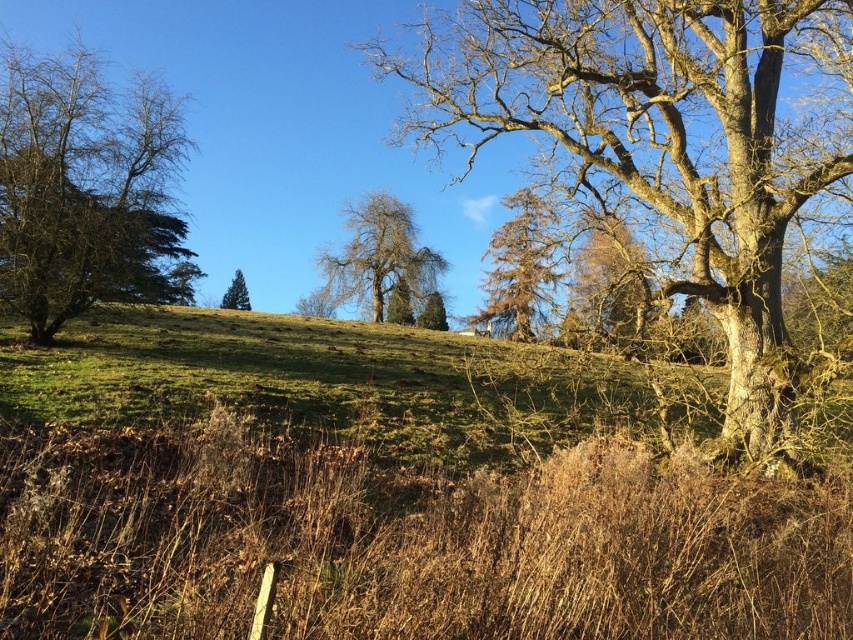
From the picture: You are planning to plant a new tree in this landscape. The new tree requires a minimum of 60 feet of space between it and any existing trees to thrive. Based on the distance between the green leafy tree at left and the bare wood tree at center, can you plant the new tree between them without violating the spacing requirement?

The green leafy tree at left and the bare wood tree at center are 72.35 feet apart from each other. Since the required minimum spacing is 60 feet, planting a new tree between them would still allow enough space as long as it stays within the 72.35 feet distance. However, the exact placement would depend on maintaining at least 60 feet from both existing trees.

You are an environmental scientist analyzing this landscape. You observe the bare wood tree at center and the brown rough tree at center. Which tree is positioned higher in the image?

The bare wood tree at center is positioned higher in the image than the brown rough tree at center.

You are standing at the center of the image. Which direction should you look to see the green leafy tree at left?

The green leafy tree at left is located at point 0.295 on the x axis and 0.098 on the y axis. Since you are at the center, you should look to the left and slightly downward to see it.